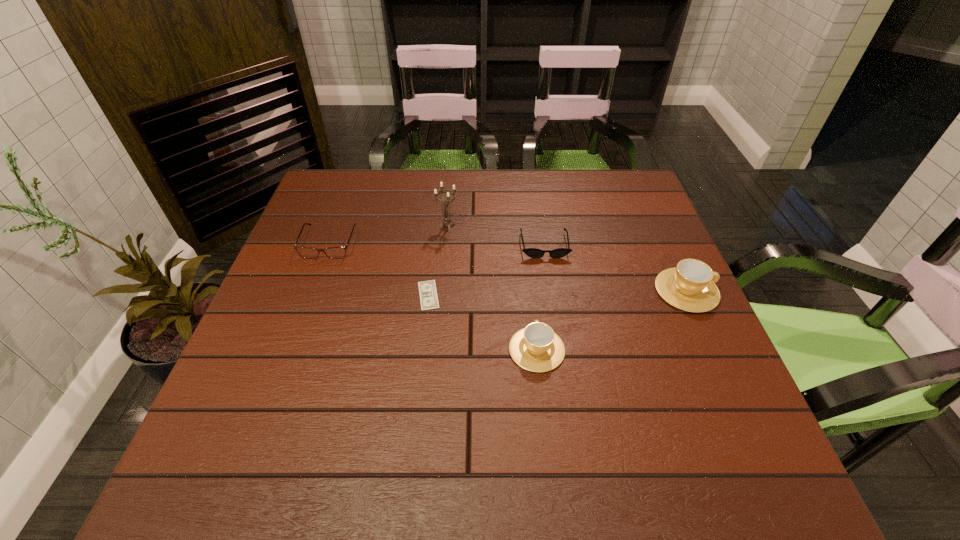
At what (x,y) coordinates should I click in order to perform the action: click on vacant space located with the handle on the side of the left cup. Please return your answer as a coordinate pair (x, y). Looking at the image, I should click on (525, 241).

What are the coordinates of `vacant point located 0.230m on the lenses of the leftmost object` in the screenshot? It's located at (298, 329).

Where is `free point located on the right of the tallest object`? This screenshot has height=540, width=960. free point located on the right of the tallest object is located at coordinates (596, 226).

The width and height of the screenshot is (960, 540). What are the coordinates of `free space located on the left of the money` in the screenshot? It's located at (304, 295).

At what (x,y) coordinates should I click in order to perform the action: click on vacant area located on the front-facing side of the fifth tallest object. Please return your answer as a coordinate pair (x, y). Looking at the image, I should click on (550, 286).

Identify the location of object positioned at the left edge. (306, 252).

The image size is (960, 540). In order to click on object located in the right edge section of the desktop in this screenshot , I will do `click(690, 286)`.

What are the coordinates of `free spot at the far edge of the desktop` in the screenshot? It's located at (389, 169).

The height and width of the screenshot is (540, 960). Find the location of `free location at the left edge of the desktop`. free location at the left edge of the desktop is located at coordinates (237, 380).

At what (x,y) coordinates should I click in order to perform the action: click on blank area at the right edge. Please return your answer as a coordinate pair (x, y). The height and width of the screenshot is (540, 960). Looking at the image, I should click on (659, 308).